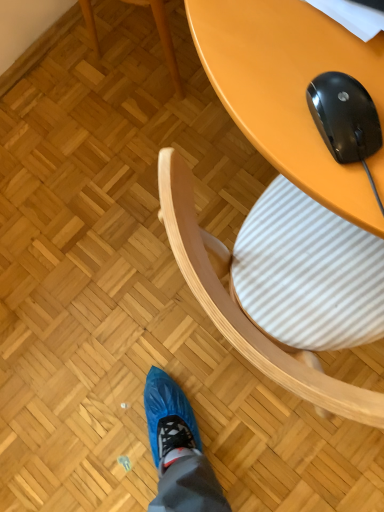
At what (x,y) coordinates should I click in order to perform the action: click on free spot in front of wooden chair at upper center. Please return your answer as a coordinate pair (x, y). Looking at the image, I should click on [164, 129].